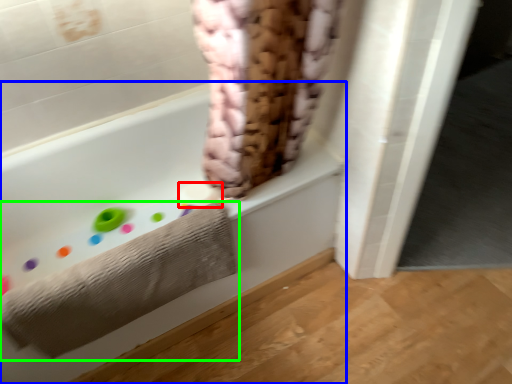
Question: Which is nearer to the toilet paper (highlighted by a red box)? bathtub (highlighted by a blue box) or towel (highlighted by a green box).

Choices:
 (A) bathtub
 (B) towel

Answer: (A)